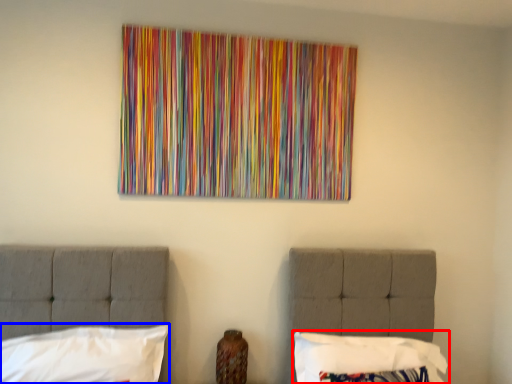
Question: Which of the following is the farthest to the observer, pillow (highlighted by a red box) or pillow (highlighted by a blue box)?

Choices:
 (A) pillow
 (B) pillow

Answer: (A)